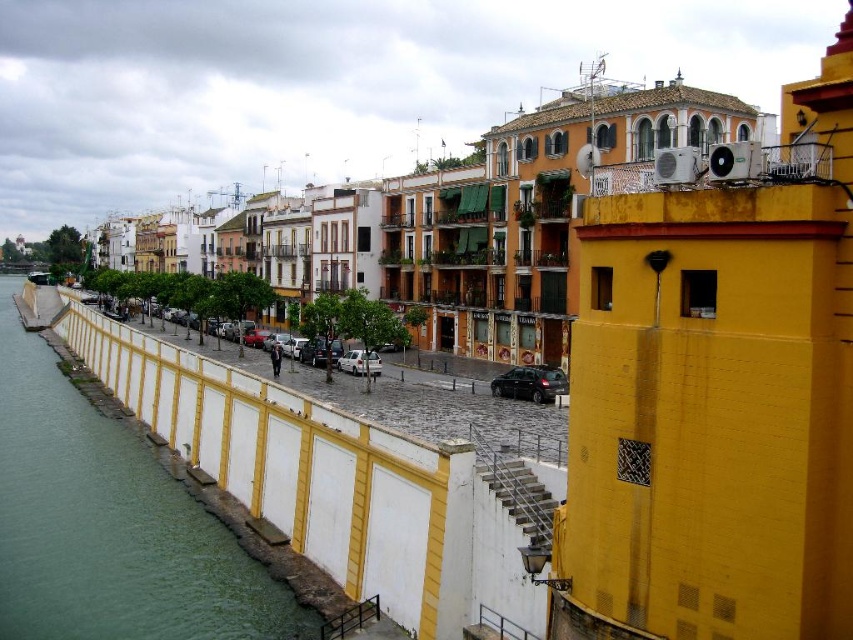
Can you confirm if shiny black car at center is thinner than silver metallic car at center?

Incorrect, shiny black car at center's width is not less than silver metallic car at center's.

Can you confirm if shiny black car at center is positioned to the right of silver metallic car at center?

Indeed, shiny black car at center is positioned on the right side of silver metallic car at center.

Who is more distant from viewer, (502, 388) or (340, 358)?

The point (340, 358) is behind.

Where is `shiny black car at center`? shiny black car at center is located at coordinates (531, 384).

From the picture: Is green concrete wall at lower left further to camera compared to silver metallic car at center?

No, green concrete wall at lower left is closer to the viewer.

Is green concrete wall at lower left above silver metallic car at center?

Actually, green concrete wall at lower left is below silver metallic car at center.

Measure the distance between green concrete wall at lower left and camera.

green concrete wall at lower left and camera are 49.53 meters apart.

You are a GUI agent. You are given a task and a screenshot of the screen. Output one action in this format:
    pyautogui.click(x=<x>, y=<y>)
    Task: Click on the green concrete wall at lower left
    
    Given the screenshot: What is the action you would take?
    coord(109,524)

Who is positioned more to the right, green concrete wall at lower left or shiny black car at center?

shiny black car at center is more to the right.

Is green concrete wall at lower left taller than shiny black car at center?

Yes, green concrete wall at lower left is taller than shiny black car at center.

Between point (102, 513) and point (566, 388), which one is positioned behind?

The point (566, 388) is more distant.

You are a GUI agent. You are given a task and a screenshot of the screen. Output one action in this format:
    pyautogui.click(x=<x>, y=<y>)
    Task: Click on the green concrete wall at lower left
    
    Given the screenshot: What is the action you would take?
    pyautogui.click(x=109, y=524)